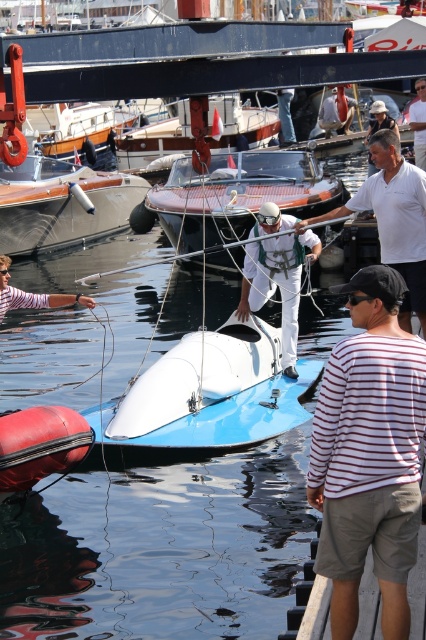
Does point (109, 195) lie in front of point (166, 148)?

Yes, point (109, 195) is in front of point (166, 148).

Is wooden polished boat at center smaller than white glossy speedboat at center?

Indeed, wooden polished boat at center has a smaller size compared to white glossy speedboat at center.

The height and width of the screenshot is (640, 426). Find the location of `wooden polished boat at center`. wooden polished boat at center is located at coordinates (62, 204).

Describe the element at coordinates (210, 394) in the screenshot. I see `white glossy boat at center` at that location.

Is white glossy boat at center below white cotton shirt at upper right?

Correct, white glossy boat at center is located below white cotton shirt at upper right.

Is point (293, 406) positioned before point (420, 131)?

Yes, it is in front of point (420, 131).

You are a GUI agent. You are given a task and a screenshot of the screen. Output one action in this format:
    pyautogui.click(x=<x>, y=<y>)
    Task: Click on the white glossy boat at center
    The width and height of the screenshot is (426, 640).
    Given the screenshot: What is the action you would take?
    pyautogui.click(x=210, y=394)

Between shiny white boat at center and white fabric man at center, which one is positioned higher?

white fabric man at center is above.

Which is more to the left, shiny white boat at center or white fabric man at center?

Positioned to the left is shiny white boat at center.

Who is more distant from viewer, (294, 195) or (334, 86)?

Point (334, 86)

Where is `shiny white boat at center`? The image size is (426, 640). shiny white boat at center is located at coordinates (238, 195).